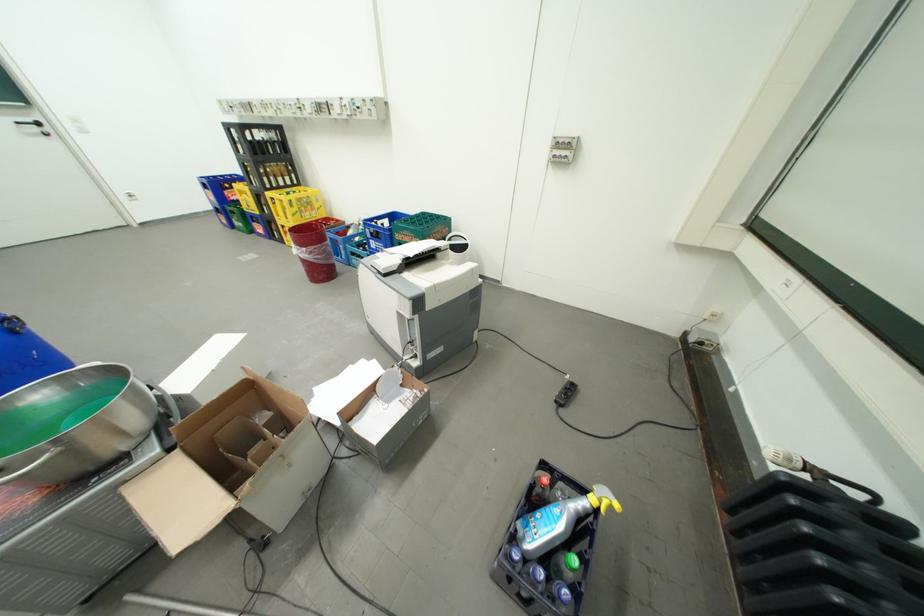
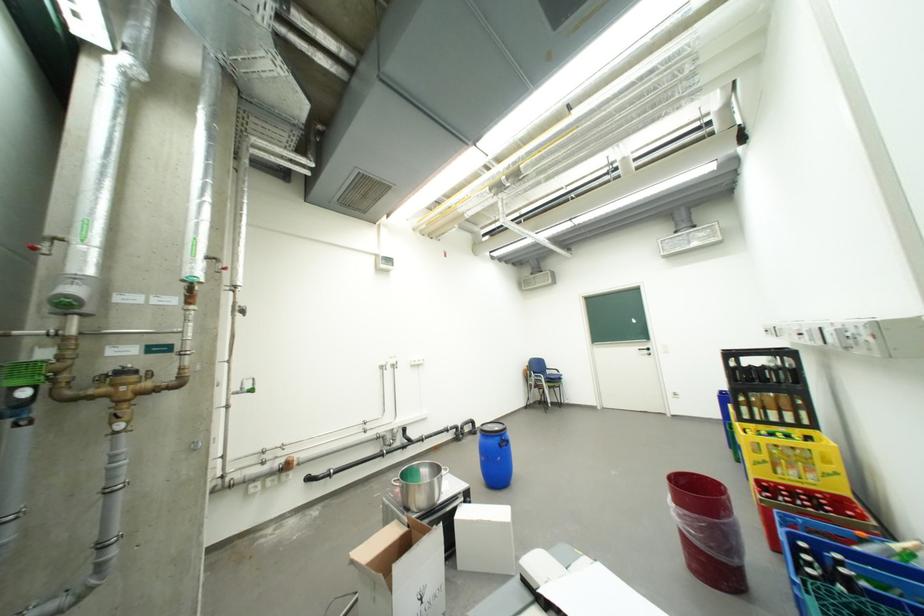
Where in the second image is the point corresponding to (x=314, y=249) from the first image?

(685, 507)